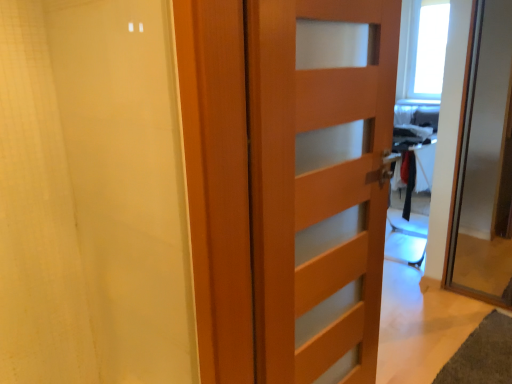
Question: From the image's perspective, is white matte shower curtain at left located above or below wooden door at right, arranged as the 2th door when viewed from the left?

Choices:
 (A) below
 (B) above

Answer: (A)

Question: From a real-world perspective, is white matte shower curtain at left positioned above or below wooden door at right, arranged as the 2th door when viewed from the left?

Choices:
 (A) above
 (B) below

Answer: (A)

Question: Considering the real-world distances, which object is farthest from the wooden door at right, arranged as the 2th door when viewed from the left?

Choices:
 (A) white matte shower curtain at left
 (B) wooden door at center, which is the second door in right-to-left order

Answer: (A)

Question: Estimate the real-world distances between objects in this image. Which object is closer to the white matte shower curtain at left?

Choices:
 (A) wooden door at center, the 1th door positioned from the left
 (B) wooden door at right, arranged as the 2th door when viewed from the left

Answer: (A)